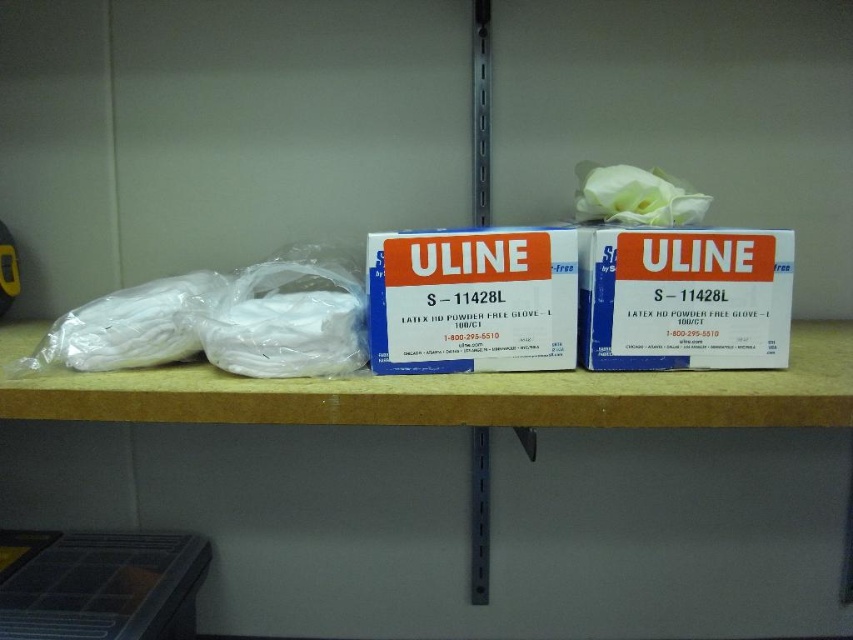
Is white plastic gloves at center positioned before blue cardboard box at center?

Yes, white plastic gloves at center is closer to the viewer.

Does white plastic gloves at center have a greater height compared to blue cardboard box at center?

In fact, white plastic gloves at center may be shorter than blue cardboard box at center.

Describe the element at coordinates (451, 394) in the screenshot. I see `white plastic gloves at center` at that location.

Find the location of a particular element. This screenshot has width=853, height=640. white plastic gloves at center is located at coordinates (451, 394).

Between white plastic gloves at center and white matte box at center, which one is positioned higher?

white matte box at center is above.

Between point (440, 404) and point (606, 356), which one is positioned in front?

Point (440, 404) is more forward.

Locate an element on the screen. white plastic gloves at center is located at coordinates (451, 394).

Can you confirm if white matte box at center is shorter than blue cardboard box at center?

Yes.

Which is behind, point (711, 250) or point (408, 291)?

Positioned behind is point (711, 250).

The image size is (853, 640). Find the location of `white matte box at center`. white matte box at center is located at coordinates (683, 298).